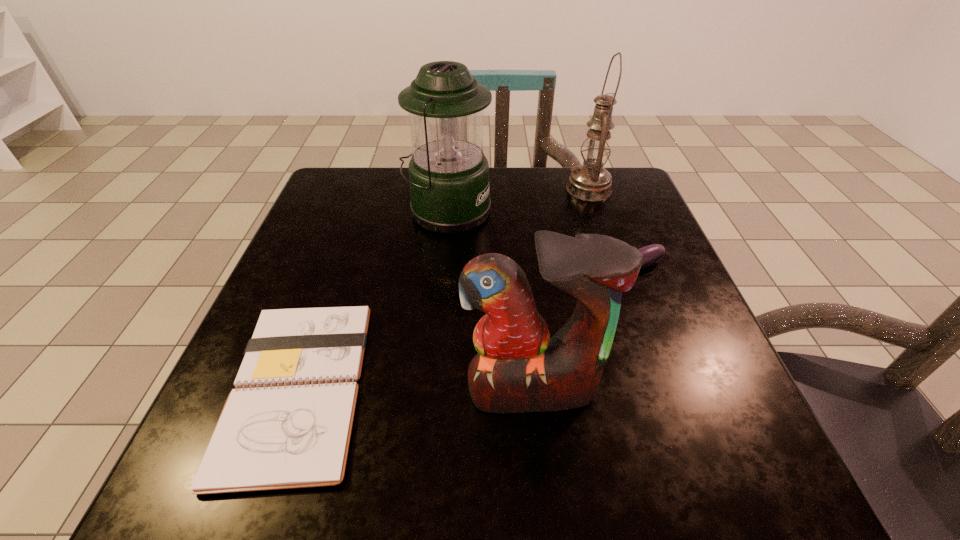
This screenshot has height=540, width=960. Identify the location of free space located 0.210m on the right of the shortest object. (500, 387).

Find the location of a particular element. This screenshot has height=540, width=960. lantern located in the far edge section of the desktop is located at coordinates (448, 173).

Image resolution: width=960 pixels, height=540 pixels. Identify the location of oil lamp located at the far edge. (591, 181).

The width and height of the screenshot is (960, 540). I want to click on object that is at the near edge, so click(x=288, y=423).

The width and height of the screenshot is (960, 540). In order to click on object that is at the left edge in this screenshot , I will do `click(288, 423)`.

Where is `oil lamp at the right edge`? oil lamp at the right edge is located at coordinates (591, 181).

Where is `eggplant that is at the right edge`? Image resolution: width=960 pixels, height=540 pixels. eggplant that is at the right edge is located at coordinates (652, 253).

Where is `object located at the near left corner`? This screenshot has height=540, width=960. object located at the near left corner is located at coordinates (288, 423).

What are the coordinates of `object positioned at the far right corner` in the screenshot? It's located at (591, 181).

Where is `free region at the far edge of the desktop`? This screenshot has width=960, height=540. free region at the far edge of the desktop is located at coordinates (503, 188).